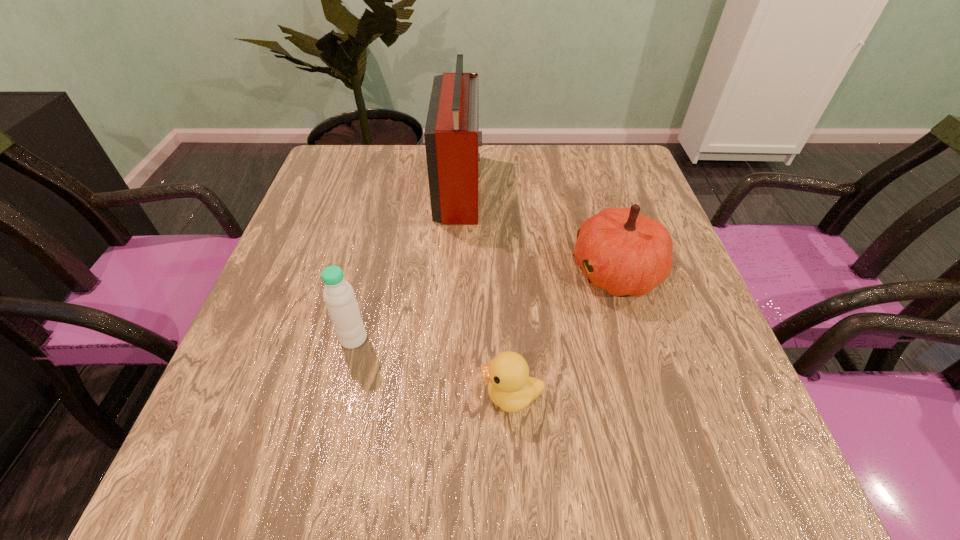
At what (x,y) coordinates should I click in order to perform the action: click on the tallest object. Please return your answer as a coordinate pair (x, y). The width and height of the screenshot is (960, 540). Looking at the image, I should click on (451, 134).

Find the location of `the farthest object`. the farthest object is located at coordinates (451, 134).

You are a GUI agent. You are given a task and a screenshot of the screen. Output one action in this format:
    pyautogui.click(x=<x>, y=<y>)
    Task: Click on the third farthest object
    Image resolution: width=960 pixels, height=540 pixels.
    Given the screenshot: What is the action you would take?
    pyautogui.click(x=338, y=294)

Locate an element on the screen. water bottle is located at coordinates click(x=338, y=294).

Identify the location of the third nearest object. The image size is (960, 540). (622, 251).

At what (x,y) coordinates should I click in order to perform the action: click on pumpkin. Please return your answer as a coordinate pair (x, y). Looking at the image, I should click on (622, 251).

I want to click on the shortest object, so click(x=510, y=387).

Identify the location of the nearest object. (510, 387).

This screenshot has height=540, width=960. I want to click on blank space located on the front-facing side of the farthest object, so click(630, 186).

The width and height of the screenshot is (960, 540). I want to click on vacant area located 0.270m on the back of the leftmost object, so click(x=378, y=235).